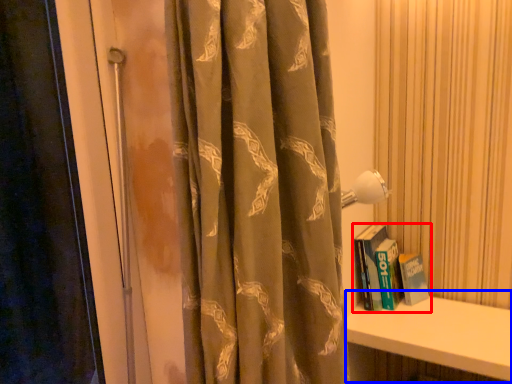
Question: Which object appears closest to the camera in this image, book (highlighted by a red box) or window sill (highlighted by a blue box)?

Choices:
 (A) book
 (B) window sill

Answer: (B)